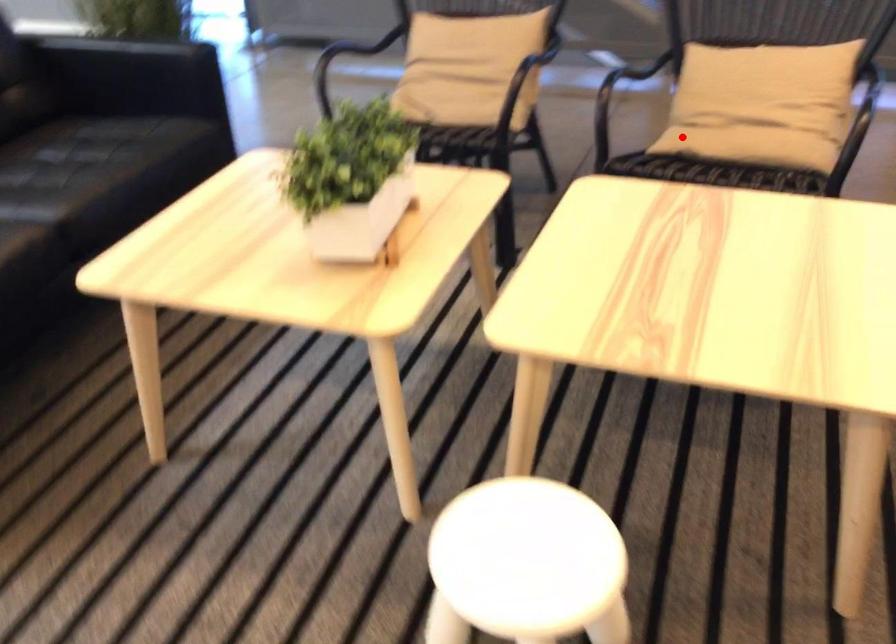
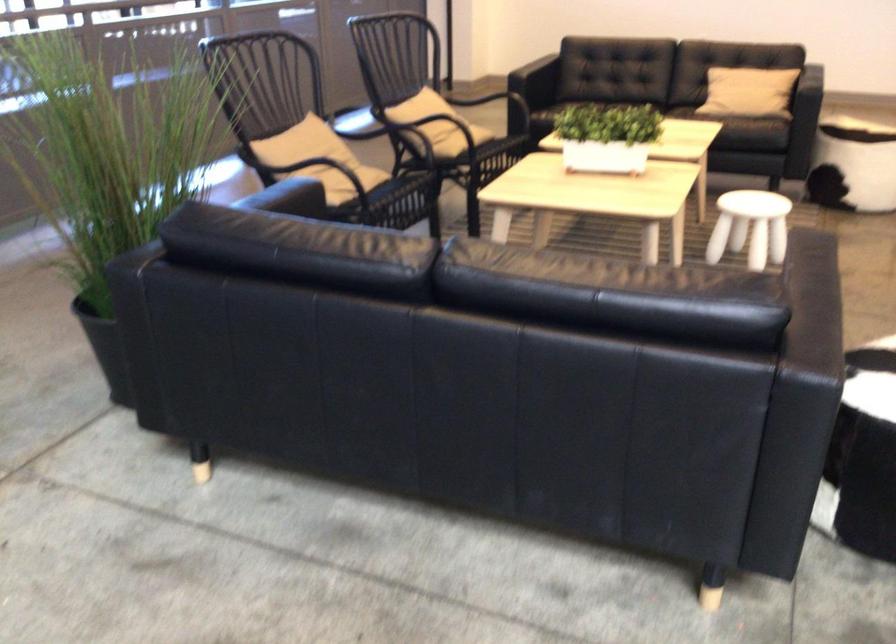
Question: I am providing you with two images of the same scene from different viewpoints. Image1 has a red point marked. In image2, the corresponding 3D location appears at what relative position? Reply with the corresponding letter.

Choices:
 (A) Closer
 (B) Farther

Answer: (B)